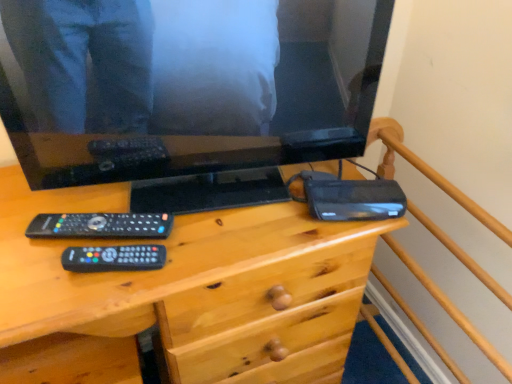
Identify the location of vacant space in between black glossy television at upper center and black matte router at right. coord(246,205).